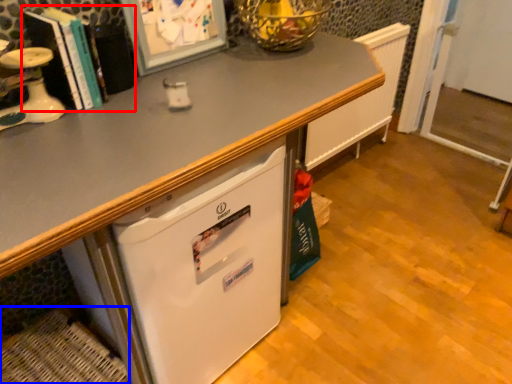
Question: Which of the following is the farthest to the observer, book (highlighted by a red box) or basket (highlighted by a blue box)?

Choices:
 (A) book
 (B) basket

Answer: (B)